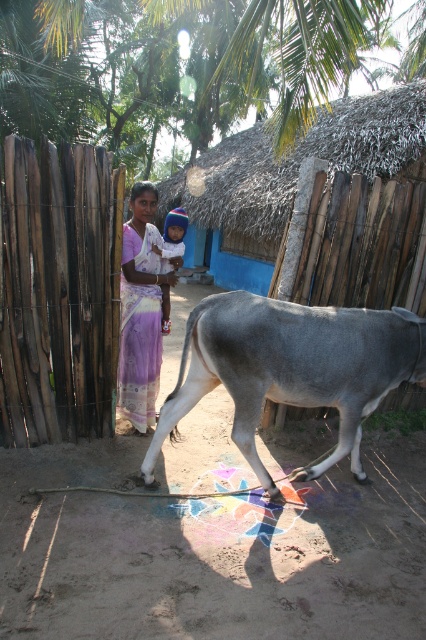
Question: Where is gray matte cow at center located in relation to purple silk saree at center in the image?

Choices:
 (A) right
 (B) left

Answer: (A)

Question: Estimate the real-world distances between objects in this image. Which object is farther from the gray matte cow at center?

Choices:
 (A) blue knitted hat at center
 (B) purple silk saree at center

Answer: (A)

Question: Which of the following is the farthest from the observer?

Choices:
 (A) (135, 184)
 (B) (170, 228)
 (C) (345, 349)

Answer: (B)

Question: Where is gray matte cow at center located in relation to blue knitted hat at center in the image?

Choices:
 (A) left
 (B) right

Answer: (B)

Question: Which of the following is the closest to the observer?

Choices:
 (A) (164, 253)
 (B) (132, 333)
 (C) (345, 404)

Answer: (C)

Question: Is gray matte cow at center to the right of blue knitted hat at center from the viewer's perspective?

Choices:
 (A) yes
 (B) no

Answer: (A)